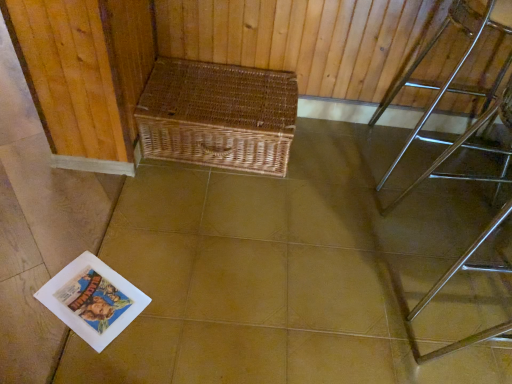
Identify the location of vacant space underneath polished chrome table at right (from a real-world perspective). tap(426, 163).